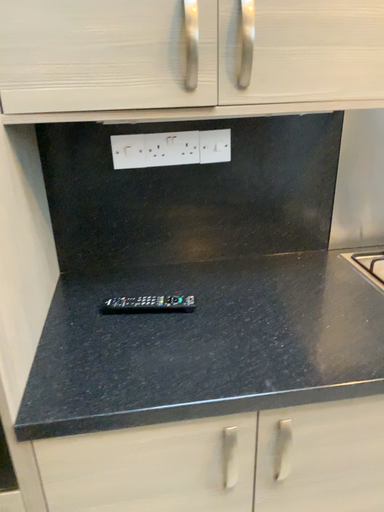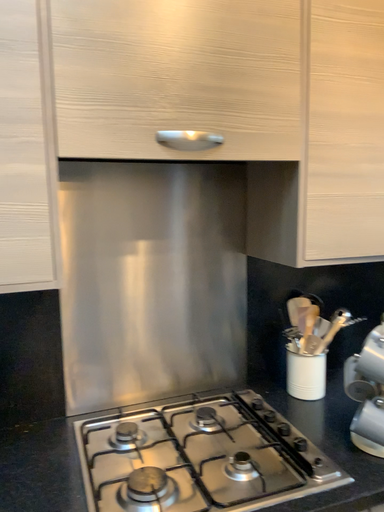
Question: How did the camera likely rotate when shooting the video?

Choices:
 (A) rotated left
 (B) rotated right

Answer: (B)